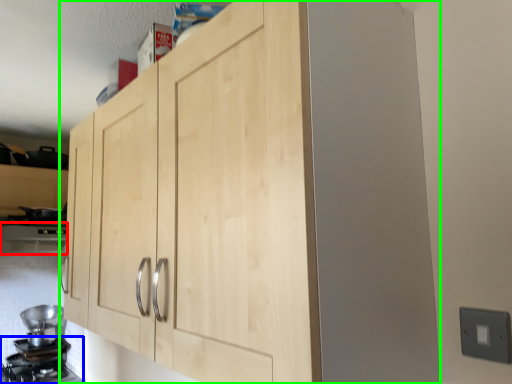
Question: Considering the real-world distances, which object is closest to vent (highlighted by a red box)? gas stove (highlighted by a blue box) or cupboard (highlighted by a green box).

Choices:
 (A) gas stove
 (B) cupboard

Answer: (A)